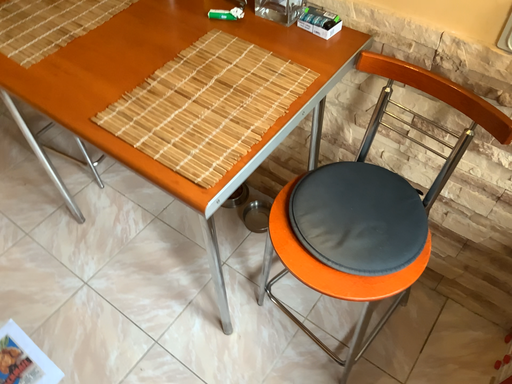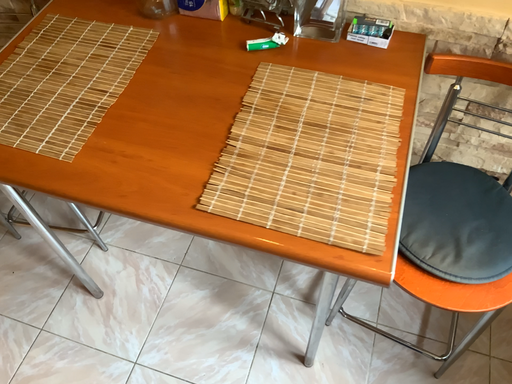
Question: How did the camera likely rotate when shooting the video?

Choices:
 (A) rotated left
 (B) rotated right

Answer: (B)